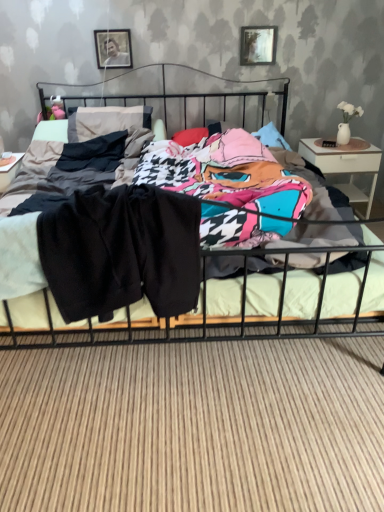
Question: Considering the relative sizes of white glossy nightstand at right and metallic silver picture frame at upper center, the 2th picture frame in the left-to-right sequence, in the image provided, is white glossy nightstand at right shorter than metallic silver picture frame at upper center, the 2th picture frame in the left-to-right sequence,?

Choices:
 (A) no
 (B) yes

Answer: (A)

Question: Is the depth of white glossy nightstand at right greater than that of metallic silver picture frame at upper center, which is the first picture frame in right-to-left order?

Choices:
 (A) yes
 (B) no

Answer: (B)

Question: From the image's perspective, does white glossy nightstand at right appear lower than metallic silver picture frame at upper center, the 2th picture frame in the left-to-right sequence?

Choices:
 (A) yes
 (B) no

Answer: (A)

Question: Is white glossy nightstand at right touching metallic silver picture frame at upper center, which is the first picture frame in right-to-left order?

Choices:
 (A) no
 (B) yes

Answer: (A)

Question: Could you tell me if white glossy nightstand at right is turned towards metallic silver picture frame at upper center, the 2th picture frame in the left-to-right sequence?

Choices:
 (A) yes
 (B) no

Answer: (B)

Question: Can we say white glossy nightstand at right lies outside metallic silver picture frame at upper center, which is the first picture frame in right-to-left order?

Choices:
 (A) yes
 (B) no

Answer: (A)

Question: Considering the relative sizes of white glossy nightstand at right and metallic black bed at center in the image provided, is white glossy nightstand at right bigger than metallic black bed at center?

Choices:
 (A) yes
 (B) no

Answer: (B)

Question: From the image's perspective, would you say white glossy nightstand at right is positioned over metallic black bed at center?

Choices:
 (A) yes
 (B) no

Answer: (A)

Question: Is the surface of white glossy nightstand at right in direct contact with metallic black bed at center?

Choices:
 (A) no
 (B) yes

Answer: (A)

Question: Does white glossy nightstand at right turn towards metallic black bed at center?

Choices:
 (A) no
 (B) yes

Answer: (A)

Question: Could metallic black bed at center be considered to be inside white glossy nightstand at right?

Choices:
 (A) no
 (B) yes

Answer: (A)

Question: Can you confirm if white glossy nightstand at right is shorter than metallic black bed at center?

Choices:
 (A) no
 (B) yes

Answer: (B)

Question: Does metallic silver picture frame at upper center, the 2th picture frame in the left-to-right sequence, have a lesser height compared to metallic silver picture frame at upper center, which ranks as the second picture frame in right-to-left order?

Choices:
 (A) yes
 (B) no

Answer: (B)